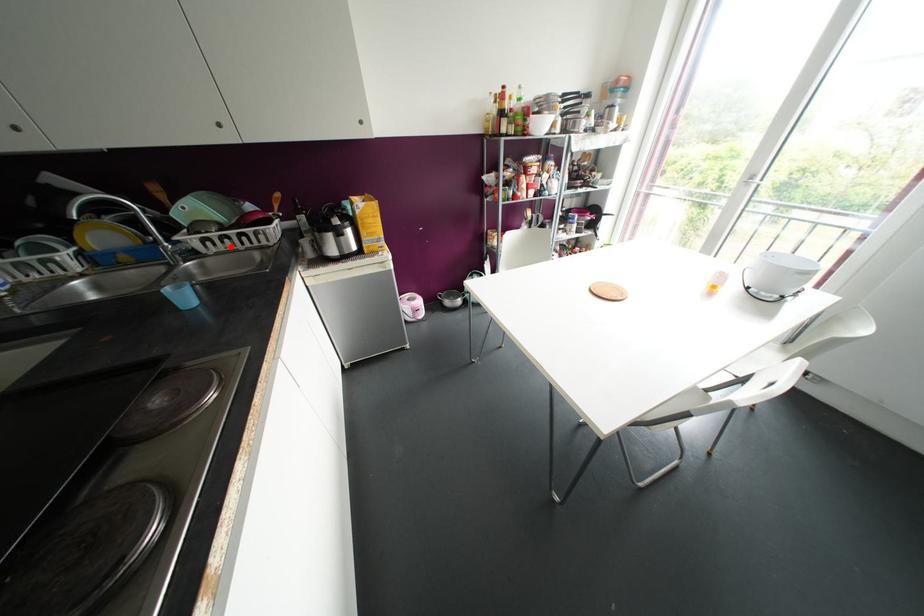
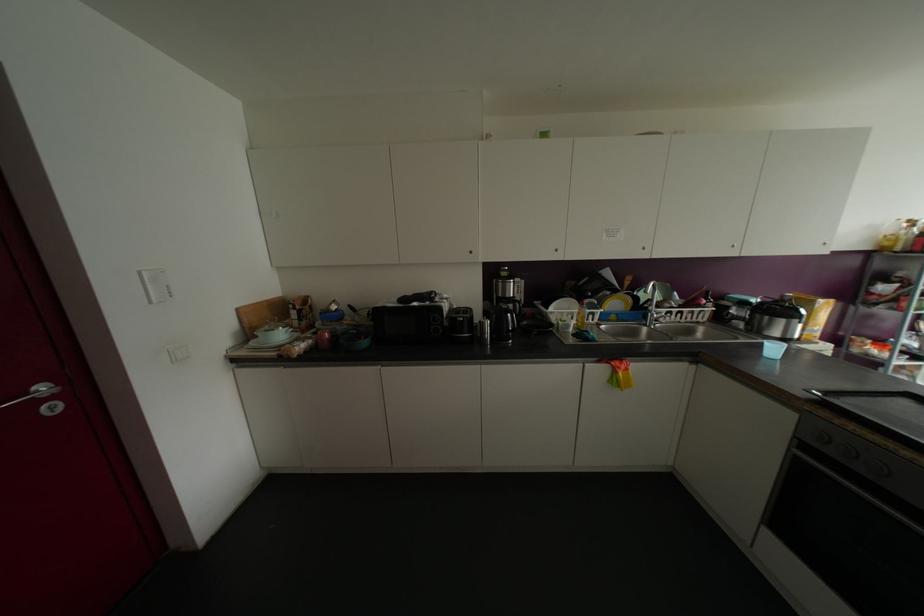
Where in the second image is the point corresponding to the highlighted location from the first image?

(677, 318)